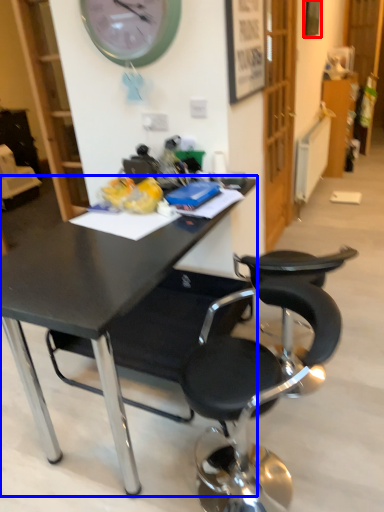
Question: Which object is further to the camera taking this photo, picture frame (highlighted by a red box) or desk (highlighted by a blue box)?

Choices:
 (A) picture frame
 (B) desk

Answer: (A)